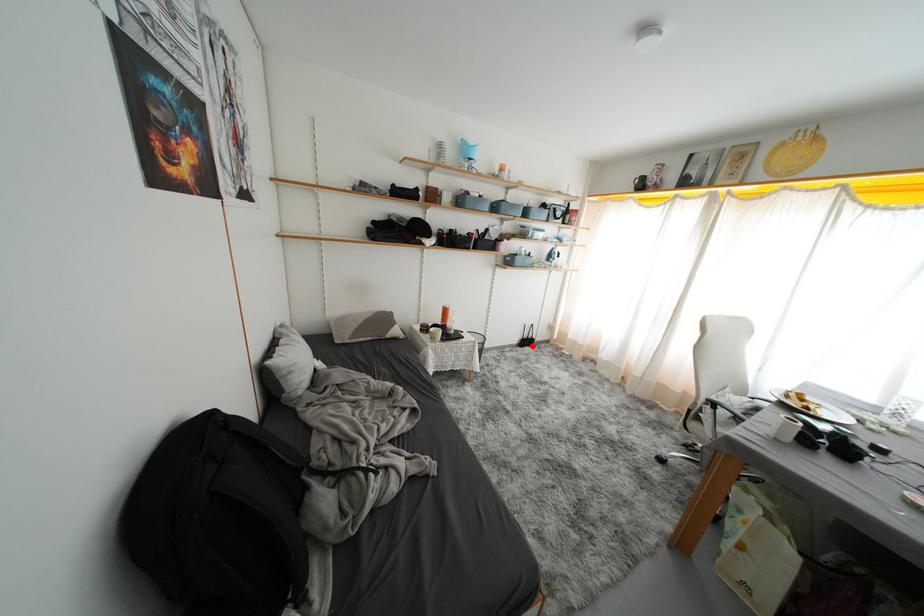
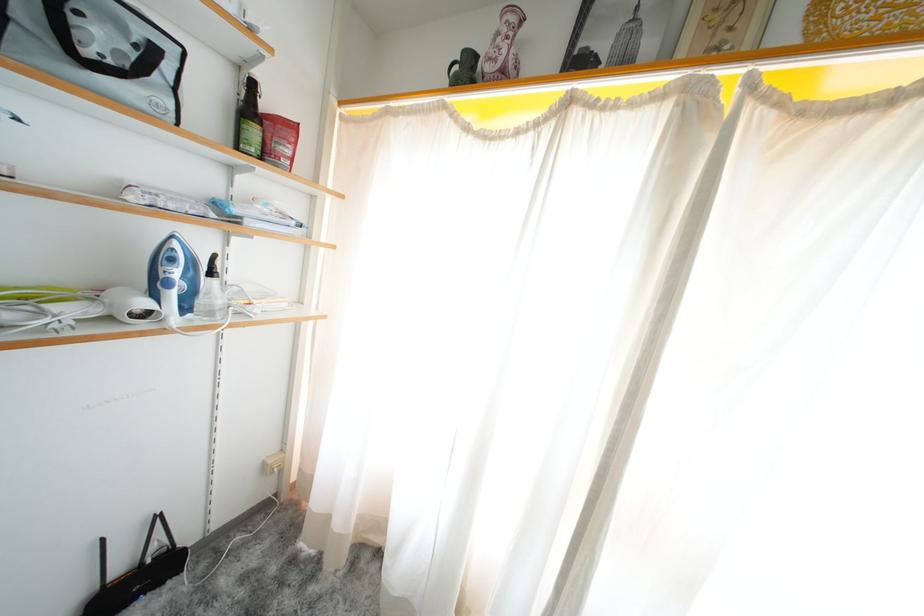
Question: I am providing you with two images of the same scene from different viewpoints. In image1, a red point is highlighted. Considering the same 3D point in image2, which of the following is correct?

Choices:
 (A) It is closer
 (B) It is farther

Answer: (A)